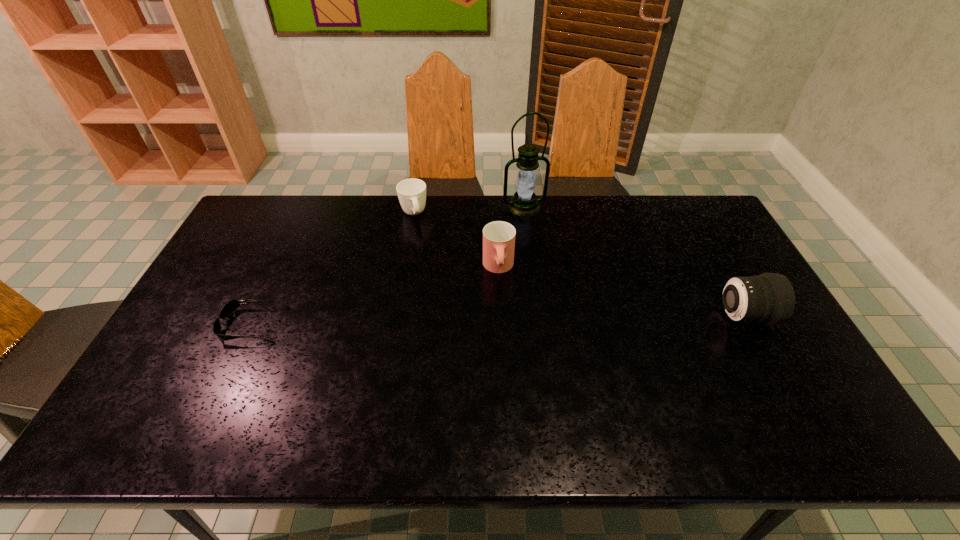
Find the location of a particular element. Image resolution: width=960 pixels, height=540 pixels. sunglasses is located at coordinates 232,305.

You are a GUI agent. You are given a task and a screenshot of the screen. Output one action in this format:
    pyautogui.click(x=<x>, y=<y>)
    Task: Click on the shortest object
    
    Given the screenshot: What is the action you would take?
    pyautogui.click(x=232, y=305)

Where is `the rightmost object`? The width and height of the screenshot is (960, 540). the rightmost object is located at coordinates (769, 298).

The width and height of the screenshot is (960, 540). I want to click on lantern, so click(524, 203).

The image size is (960, 540). Identify the location of the nearer cup. (x=498, y=237).

Where is `the taller cup`? The width and height of the screenshot is (960, 540). the taller cup is located at coordinates (498, 237).

Locate an element on the screen. The width and height of the screenshot is (960, 540). the shorter cup is located at coordinates (411, 192).

The width and height of the screenshot is (960, 540). Identify the location of the fourth object from right to left. (411, 192).

At what (x,y) coordinates should I click in order to perform the action: click on free space located 0.110m on the front-facing side of the leftmost object. Please return your answer as a coordinate pair (x, y). The height and width of the screenshot is (540, 960). Looking at the image, I should click on (183, 325).

The height and width of the screenshot is (540, 960). What are the coordinates of `vacant area situated 0.120m on the front-facing side of the leftmost object` in the screenshot? It's located at (180, 325).